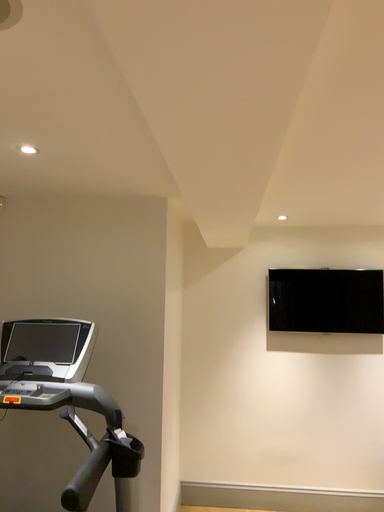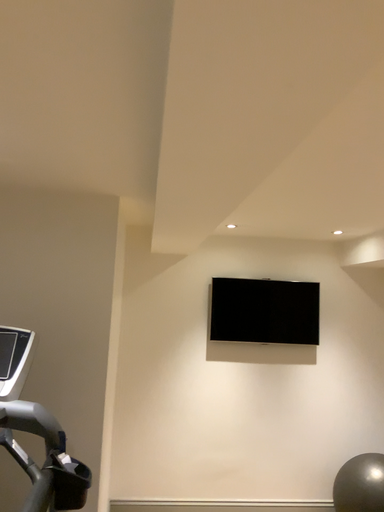
Question: Which way did the camera rotate in the video?

Choices:
 (A) rotated right
 (B) rotated left

Answer: (A)